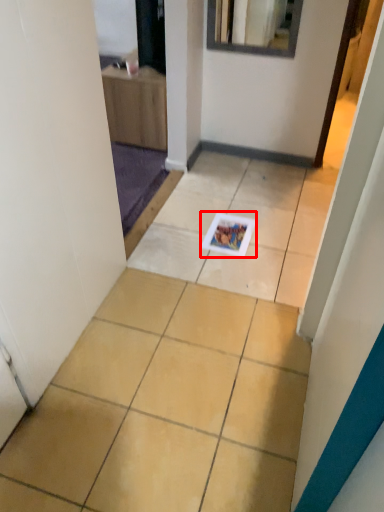
Question: In this image, where is magazine (annotated by the red box) located relative to ceramic tile?

Choices:
 (A) right
 (B) left

Answer: (A)